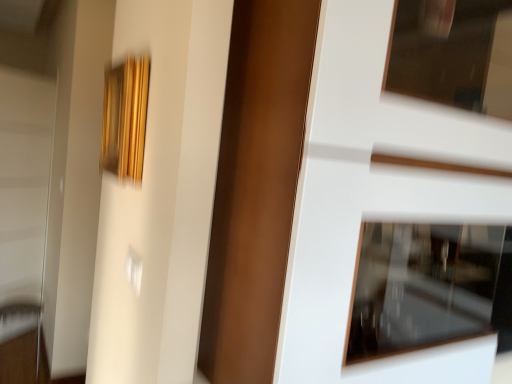
I want to click on white glossy screen door at left, so click(x=24, y=221).

What do you see at coordinates (125, 117) in the screenshot?
I see `gold textured frame at upper left` at bounding box center [125, 117].

This screenshot has height=384, width=512. What do you see at coordinates (376, 200) in the screenshot? I see `white glossy door at center` at bounding box center [376, 200].

You are a GUI agent. You are given a task and a screenshot of the screen. Output one action in this format:
    pyautogui.click(x=<x>, y=<y>)
    Task: Click on the white glossy screen door at left
    Image resolution: width=512 pixels, height=384 pixels.
    Given the screenshot: What is the action you would take?
    pos(24,221)

Is gold textured frame at upper left taller or shorter than metallic silver door handle at lower left?

Considering their sizes, gold textured frame at upper left has less height than metallic silver door handle at lower left.

Where is `furniture beneath the gold textured frame at upper left (from a real-world perspective)`? furniture beneath the gold textured frame at upper left (from a real-world perspective) is located at coordinates (22, 344).

Considering their positions, is gold textured frame at upper left located in front of or behind metallic silver door handle at lower left?

In the image, gold textured frame at upper left appears in front of metallic silver door handle at lower left.

Is gold textured frame at upper left looking in the opposite direction of metallic silver door handle at lower left?

No, gold textured frame at upper left is not facing the opposite direction of metallic silver door handle at lower left.

Considering the relative sizes of metallic silver door handle at lower left and gold textured frame at upper left in the image provided, is metallic silver door handle at lower left shorter than gold textured frame at upper left?

No, metallic silver door handle at lower left is not shorter than gold textured frame at upper left.

Looking at this image, can you tell me how much metallic silver door handle at lower left and gold textured frame at upper left differ in facing direction?

There is a 0.117-degree angle between the facing directions of metallic silver door handle at lower left and gold textured frame at upper left.

Considering the points (32, 322) and (108, 67), which point is behind, point (32, 322) or point (108, 67)?

Positioned behind is point (32, 322).

Would you say gold textured frame at upper left is part of metallic silver door handle at lower left's contents?

That's incorrect, gold textured frame at upper left is not inside metallic silver door handle at lower left.

Looking at this image, from the image's perspective, which is above, white glossy door at center or white glossy screen door at left?

From the image's view, white glossy door at center is above.

Is white glossy door at center not close to white glossy screen door at left?

Yes.

Is white glossy door at center aimed at white glossy screen door at left?

No.

Identify the location of screen door that appears behind the white glossy door at center. (24, 221).

Which of these two, gold textured frame at upper left or white glossy screen door at left, is smaller?

With smaller size is gold textured frame at upper left.

Which is more distant, (109, 84) or (35, 204)?

The point (35, 204) is behind.

From the image's perspective, is gold textured frame at upper left positioned above or below white glossy screen door at left?

gold textured frame at upper left is above white glossy screen door at left.

Is gold textured frame at upper left not within white glossy screen door at left?

That's correct, gold textured frame at upper left is outside of white glossy screen door at left.

Is metallic silver door handle at lower left wider than white glossy screen door at left?

Yes.

From a real-world perspective, is metallic silver door handle at lower left positioned above or below white glossy screen door at left?

metallic silver door handle at lower left is below white glossy screen door at left.

Find the location of a particular element. This screenshot has width=512, height=384. furniture in front of the white glossy screen door at left is located at coordinates (22, 344).

Is metallic silver door handle at lower left not within white glossy screen door at left?

Yes, metallic silver door handle at lower left is outside of white glossy screen door at left.

From a real-world perspective, which is physically above, white glossy screen door at left or metallic silver door handle at lower left?

white glossy screen door at left.

Is point (4, 324) in front of point (22, 310)?

Yes, it is in front of point (22, 310).

Which object is further away from the camera, white glossy screen door at left or metallic silver door handle at lower left?

Positioned behind is white glossy screen door at left.

Looking at this image, considering the relative sizes of white glossy screen door at left and metallic silver door handle at lower left in the image provided, is white glossy screen door at left taller than metallic silver door handle at lower left?

Yes.

Can you confirm if white glossy door at center is positioned to the right of metallic silver door handle at lower left?

Yes.

Is white glossy door at center inside or outside of metallic silver door handle at lower left?

white glossy door at center is spatially situated outside metallic silver door handle at lower left.

Is white glossy door at center further to camera compared to metallic silver door handle at lower left?

No, white glossy door at center is closer to the viewer.

From their relative heights in the image, would you say white glossy door at center is taller or shorter than metallic silver door handle at lower left?

Clearly, white glossy door at center is taller compared to metallic silver door handle at lower left.

Identify the location of picture frame lying on the right of metallic silver door handle at lower left. (125, 117).

Image resolution: width=512 pixels, height=384 pixels. I want to click on picture frame in front of the metallic silver door handle at lower left, so click(125, 117).

Which object lies further to the anchor point gold textured frame at upper left, metallic silver door handle at lower left or white glossy door at center?

metallic silver door handle at lower left is positioned further to the anchor gold textured frame at upper left.

When comparing their distances from gold textured frame at upper left, does white glossy screen door at left or white glossy door at center seem closer?

The object closer to gold textured frame at upper left is white glossy door at center.

When comparing their distances from metallic silver door handle at lower left, does white glossy screen door at left or gold textured frame at upper left seem further?

gold textured frame at upper left is further to metallic silver door handle at lower left.

When comparing their distances from gold textured frame at upper left, does white glossy door at center or white glossy screen door at left seem closer?

Among the two, white glossy door at center is located nearer to gold textured frame at upper left.

Based on the photo, considering their positions, is metallic silver door handle at lower left positioned closer to white glossy door at center than gold textured frame at upper left?

gold textured frame at upper left lies closer to white glossy door at center than the other object.

Based on their spatial positions, is metallic silver door handle at lower left or white glossy screen door at left further from gold textured frame at upper left?

white glossy screen door at left.

Consider the image. Estimate the real-world distances between objects in this image. Which object is further from white glossy door at center, white glossy screen door at left or metallic silver door handle at lower left?

white glossy screen door at left lies further to white glossy door at center than the other object.

When comparing their distances from white glossy screen door at left, does metallic silver door handle at lower left or gold textured frame at upper left seem closer?

Among the two, metallic silver door handle at lower left is located nearer to white glossy screen door at left.

Identify the location of furniture between gold textured frame at upper left and white glossy screen door at left from front to back. (22, 344).

You are a GUI agent. You are given a task and a screenshot of the screen. Output one action in this format:
    pyautogui.click(x=<x>, y=<y>)
    Task: Click on the picture frame located between white glossy door at center and metallic silver door handle at lower left in the depth direction
    The image size is (512, 384).
    Given the screenshot: What is the action you would take?
    pyautogui.click(x=125, y=117)

The image size is (512, 384). I want to click on picture frame between white glossy door at center and white glossy screen door at left along the z-axis, so [x=125, y=117].

Locate an element on the screen. furniture between white glossy door at center and white glossy screen door at left from front to back is located at coordinates (22, 344).